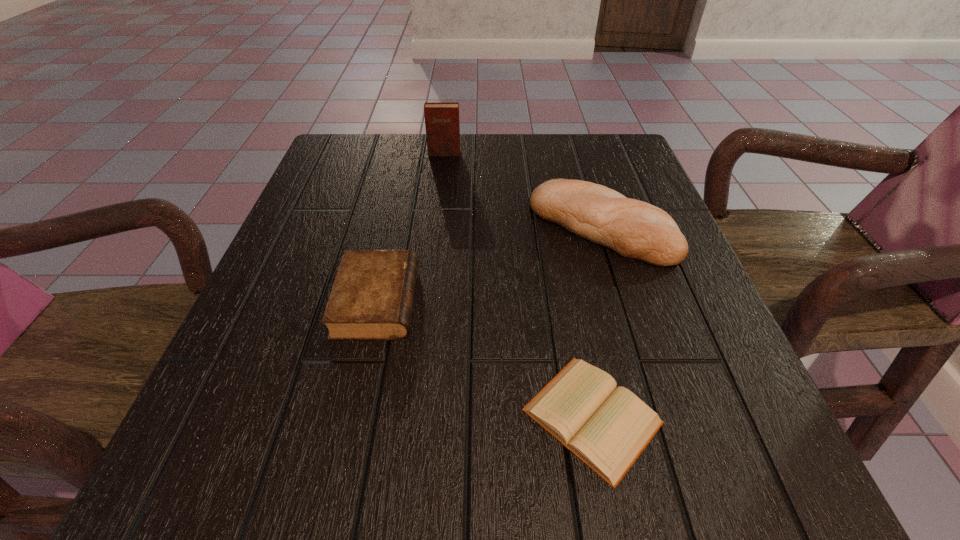
Locate an element on the screen. Image resolution: width=960 pixels, height=540 pixels. the tallest object is located at coordinates (442, 126).

Where is `the tallest diary`? the tallest diary is located at coordinates (442, 126).

Identify the location of bread. Image resolution: width=960 pixels, height=540 pixels. (634, 229).

Where is `the second nearest diary`? This screenshot has height=540, width=960. the second nearest diary is located at coordinates (372, 296).

Identify the location of the second shortest diary. (372, 296).

Where is `the rightmost diary`? The image size is (960, 540). the rightmost diary is located at coordinates (606, 427).

Where is `the nearest object`? The width and height of the screenshot is (960, 540). the nearest object is located at coordinates (606, 427).

Where is `vacant area situated on the front cover of the tallest diary`? This screenshot has height=540, width=960. vacant area situated on the front cover of the tallest diary is located at coordinates (435, 239).

Locate an element on the screen. free point located on the front of the bread is located at coordinates (647, 374).

The width and height of the screenshot is (960, 540). I want to click on free point located 0.090m on the spine side of the second tallest diary, so click(x=467, y=301).